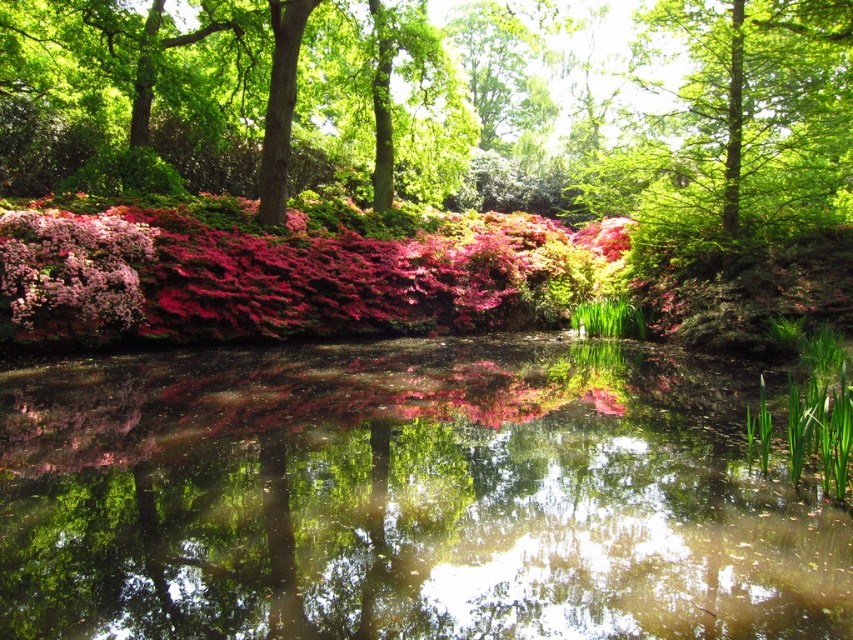
Between transparent water at center and pink matte flowers at center, which one is positioned lower?

Positioned lower is transparent water at center.

Is transparent water at center bigger than pink matte flowers at center?

Actually, transparent water at center might be smaller than pink matte flowers at center.

Describe the element at coordinates (403, 497) in the screenshot. I see `transparent water at center` at that location.

Where is `transparent water at center`? This screenshot has width=853, height=640. transparent water at center is located at coordinates [x=403, y=497].